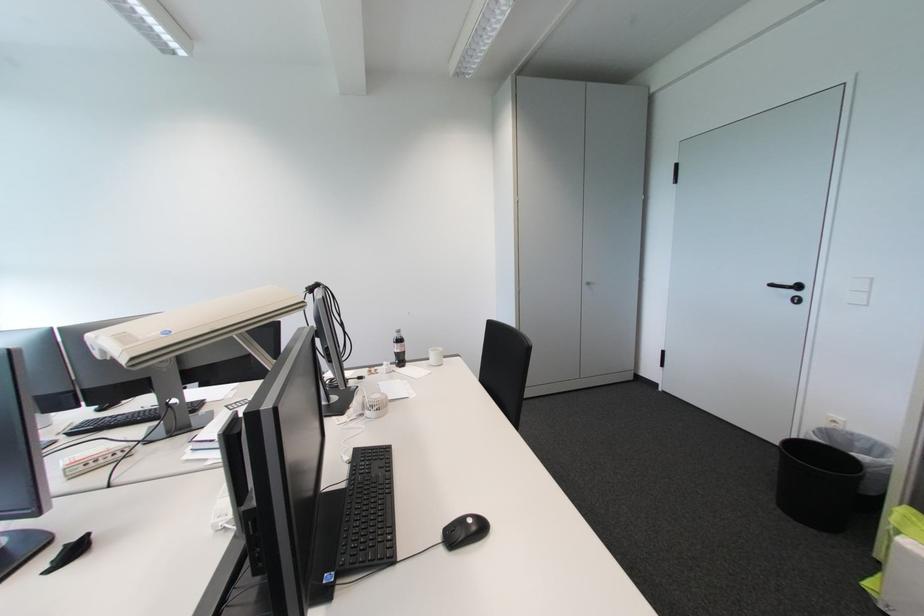
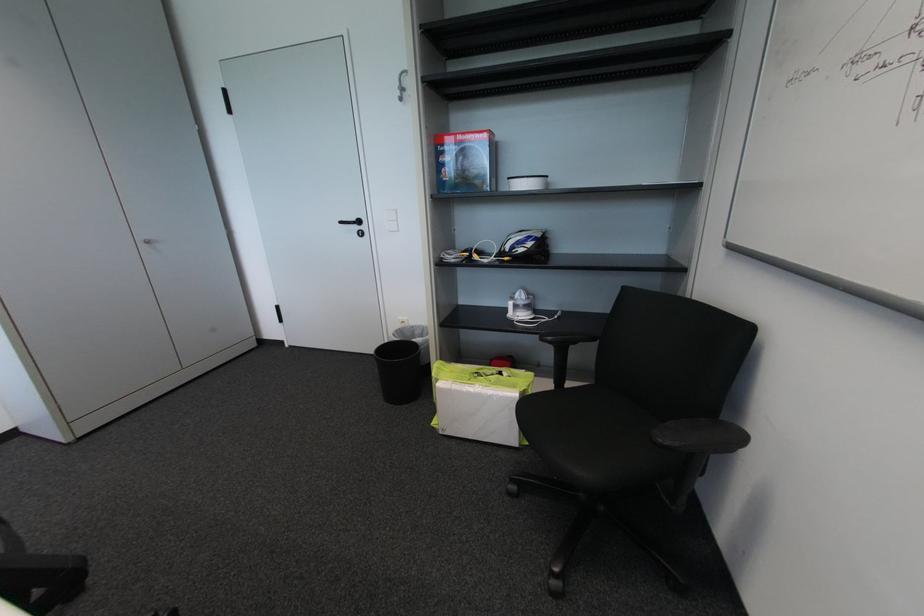
The point at (591, 286) is marked in the first image. Where is the corresponding point in the second image?

(151, 246)